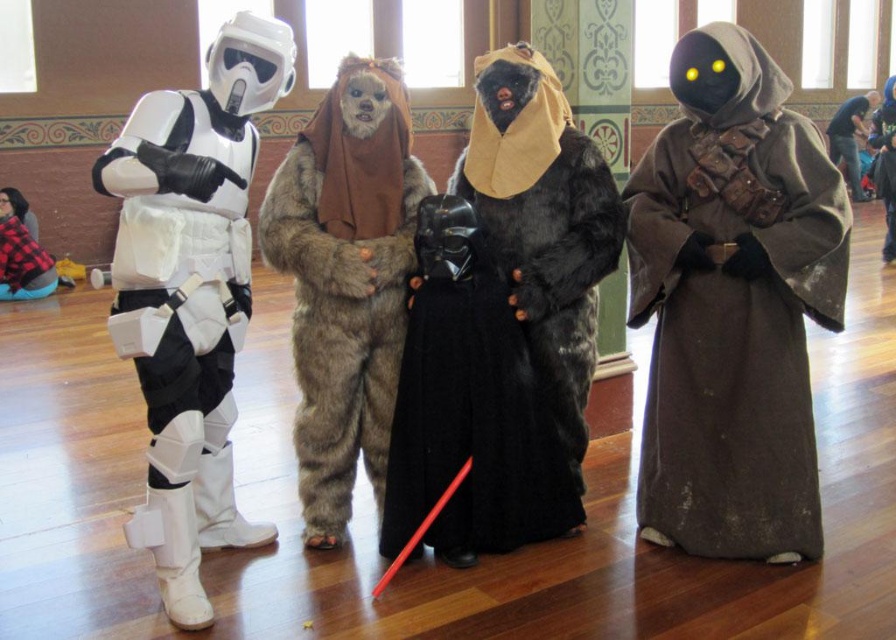
Question: Which of the following is the closest to the observer?

Choices:
 (A) (533, 352)
 (B) (339, 211)
 (C) (885, 193)
 (D) (29, 243)

Answer: (B)

Question: Is fuzzy black cape at center to the right of white matte/soft plastic stormtrooper at left from the viewer's perspective?

Choices:
 (A) no
 (B) yes

Answer: (B)

Question: Which object is positioned farthest from the white matte/soft plastic stormtrooper at left?

Choices:
 (A) brown suede robe at right
 (B) dark brown fabric bag at upper right

Answer: (B)

Question: Which of the following is the closest to the observer?

Choices:
 (A) (378, 104)
 (B) (882, 256)
 (C) (773, 490)
 (D) (388, 467)

Answer: (C)

Question: Is the position of brown suede robe at right less distant than that of brown fuzzy coat at center?

Choices:
 (A) no
 (B) yes

Answer: (B)

Question: Is brown suede robe at right to the left of furry costume at center from the viewer's perspective?

Choices:
 (A) no
 (B) yes

Answer: (A)